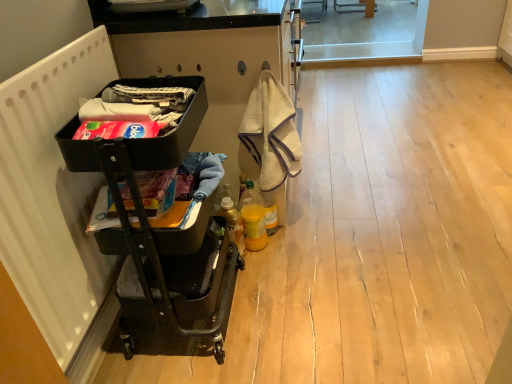
What do you see at coordinates (133, 112) in the screenshot? The image size is (512, 384). I see `matte black laundry basket at left, which appears as the 1th laundry when viewed from the top` at bounding box center [133, 112].

Locate an element on the screen. The width and height of the screenshot is (512, 384). beige towel at center is located at coordinates [271, 132].

You are a GUI agent. You are given a task and a screenshot of the screen. Output one action in this format:
    pyautogui.click(x=<x>, y=<y>)
    Task: Click on the black metal cart at left
    This screenshot has height=384, width=512.
    Given the screenshot: What is the action you would take?
    pyautogui.click(x=162, y=228)

Image resolution: width=512 pixels, height=384 pixels. What do you see at coordinates (233, 223) in the screenshot?
I see `translucent plastic bottle at lower center, which is the 1th bottle from left to right` at bounding box center [233, 223].

Describe the element at coordinates (187, 191) in the screenshot. Image resolution: width=512 pixels, height=384 pixels. I see `matte black laundry basket at left, which is the second laundry in top-to-bottom order` at that location.

Locate an element on the screen. translucent plastic bottle at center, the 2th bottle viewed from the left is located at coordinates 270,212.

I want to click on matte black laundry basket at left, which appears as the 1th laundry when viewed from the top, so click(x=133, y=112).

Is translucent plastic bottle at lower center, which is the 1th bottle from left to right, with beige towel at center?

translucent plastic bottle at lower center, which is the 1th bottle from left to right, and beige towel at center are clearly separated.

In terms of width, does translucent plastic bottle at lower center, which is the 1th bottle from left to right, look wider or thinner when compared to beige towel at center?

Considering their sizes, translucent plastic bottle at lower center, which is the 1th bottle from left to right, looks slimmer than beige towel at center.

Is translucent plastic bottle at lower center, placed as the second bottle when sorted from right to left, oriented towards beige towel at center?

No, translucent plastic bottle at lower center, placed as the second bottle when sorted from right to left, is not turned towards beige towel at center.

In the image, is matte black laundry basket at left, placed as the 1th laundry when sorted from bottom to top, positioned in front of or behind translucent plastic bottle at lower center, placed as the second bottle when sorted from right to left?

matte black laundry basket at left, placed as the 1th laundry when sorted from bottom to top, is in front of translucent plastic bottle at lower center, placed as the second bottle when sorted from right to left.

How different are the orientations of matte black laundry basket at left, which is the second laundry in top-to-bottom order, and translucent plastic bottle at lower center, which is the 1th bottle from left to right, in degrees?

The angle between the facing direction of matte black laundry basket at left, which is the second laundry in top-to-bottom order, and the facing direction of translucent plastic bottle at lower center, which is the 1th bottle from left to right, is 4.31 degrees.

From a real-world perspective, is matte black laundry basket at left, placed as the 1th laundry when sorted from bottom to top, on translucent plastic bottle at lower center, which is the 1th bottle from left to right?

Indeed, from a real-world perspective, matte black laundry basket at left, placed as the 1th laundry when sorted from bottom to top, stands above translucent plastic bottle at lower center, which is the 1th bottle from left to right.

Is matte black laundry basket at left, placed as the 1th laundry when sorted from bottom to top, wider than translucent plastic bottle at lower center, placed as the second bottle when sorted from right to left?

Yes.

From a real-world perspective, is translucent plastic bottle at lower center, which is the 1th bottle from left to right, physically located above or below black metal cart at left?

Clearly, from a real-world perspective, translucent plastic bottle at lower center, which is the 1th bottle from left to right, is below black metal cart at left.

Is point (229, 201) in front of point (198, 103)?

No, it is not.

Would you say black metal cart at left is part of translucent plastic bottle at lower center, placed as the second bottle when sorted from right to left,'s contents?

No.

Based on the photo, is translucent plastic bottle at lower center, placed as the second bottle when sorted from right to left, aimed at black metal cart at left?

No, translucent plastic bottle at lower center, placed as the second bottle when sorted from right to left, is not oriented towards black metal cart at left.

Identify the location of the 1st laundry positioned above the black metal cart at left (from a real-world perspective). The image size is (512, 384). (187, 191).

Is point (157, 81) farther from camera compared to point (216, 159)?

No.

Does black metal cart at left have a greater height compared to matte black laundry basket at left, which is the second laundry in top-to-bottom order?

Indeed, black metal cart at left has a greater height compared to matte black laundry basket at left, which is the second laundry in top-to-bottom order.

Which of these two, black metal cart at left or matte black laundry basket at left, which is the second laundry in top-to-bottom order, is bigger?

With larger size is black metal cart at left.

Measure the distance from translucent plastic bottle at center, the 1th bottle from the right, to white matte radiator at left.

translucent plastic bottle at center, the 1th bottle from the right, and white matte radiator at left are 33.37 inches apart from each other.

Are translucent plastic bottle at center, the 1th bottle from the right, and white matte radiator at left located far from each other?

translucent plastic bottle at center, the 1th bottle from the right, is actually quite close to white matte radiator at left.

Considering the sizes of translucent plastic bottle at center, the 2th bottle viewed from the left, and white matte radiator at left in the image, is translucent plastic bottle at center, the 2th bottle viewed from the left, bigger or smaller than white matte radiator at left?

Clearly, translucent plastic bottle at center, the 2th bottle viewed from the left, is smaller in size than white matte radiator at left.

Which is more to the left, translucent plastic bottle at center, the 2th bottle viewed from the left, or white matte radiator at left?

Positioned to the left is white matte radiator at left.

You are a GUI agent. You are given a task and a screenshot of the screen. Output one action in this format:
    pyautogui.click(x=<x>, y=<y>)
    Task: Click on the material that is on the right side of white matte radiator at left
    The height and width of the screenshot is (384, 512).
    Given the screenshot: What is the action you would take?
    pyautogui.click(x=271, y=132)

In terms of width, does white matte radiator at left look wider or thinner when compared to beige towel at center?

Clearly, white matte radiator at left has less width compared to beige towel at center.

Does point (78, 345) appear closer or farther from the camera than point (262, 175)?

Point (78, 345) appears to be closer to the viewer than point (262, 175).

Is white matte radiator at left outside of beige towel at center?

Yes, white matte radiator at left is located beyond the bounds of beige towel at center.

Who is taller, matte black laundry basket at left, placed as the 1th laundry when sorted from bottom to top, or matte black laundry basket at left, marked as the 2th laundry in a bottom-to-top arrangement?

Standing taller between the two is matte black laundry basket at left, marked as the 2th laundry in a bottom-to-top arrangement.

Is matte black laundry basket at left, which is the second laundry in top-to-bottom order, at the left side of matte black laundry basket at left, marked as the 2th laundry in a bottom-to-top arrangement?

No.

Consider the image. Is matte black laundry basket at left, which is the second laundry in top-to-bottom order, completely or partially outside of matte black laundry basket at left, marked as the 2th laundry in a bottom-to-top arrangement?

Absolutely, matte black laundry basket at left, which is the second laundry in top-to-bottom order, is external to matte black laundry basket at left, marked as the 2th laundry in a bottom-to-top arrangement.

Which of these two, matte black laundry basket at left, placed as the 1th laundry when sorted from bottom to top, or matte black laundry basket at left, marked as the 2th laundry in a bottom-to-top arrangement, is bigger?

matte black laundry basket at left, placed as the 1th laundry when sorted from bottom to top.

Image resolution: width=512 pixels, height=384 pixels. I want to click on material lying above the translucent plastic bottle at lower center, placed as the second bottle when sorted from right to left (from the image's perspective), so click(x=271, y=132).

At what (x,y) coordinates should I click in order to perform the action: click on the 1st laundry to the left of the translucent plastic bottle at lower center, which is the 1th bottle from left to right, starting your count from the anchor. Please return your answer as a coordinate pair (x, y). The image size is (512, 384). Looking at the image, I should click on (187, 191).

Which object lies further to the anchor point beige towel at center, translucent plastic bottle at center, the 1th bottle from the right, or white matte radiator at left?

white matte radiator at left is further to beige towel at center.

Looking at the image, which one is located further to white matte radiator at left, translucent plastic bottle at center, the 2th bottle viewed from the left, or beige towel at center?

translucent plastic bottle at center, the 2th bottle viewed from the left.

Estimate the real-world distances between objects in this image. Which object is closer to translucent plastic bottle at lower center, placed as the second bottle when sorted from right to left, translucent plastic bottle at center, the 1th bottle from the right, or black metal cart at left?

The object closer to translucent plastic bottle at lower center, placed as the second bottle when sorted from right to left, is translucent plastic bottle at center, the 1th bottle from the right.

Estimate the real-world distances between objects in this image. Which object is further from white matte radiator at left, matte black laundry basket at left, which is the second laundry in top-to-bottom order, or translucent plastic bottle at center, the 2th bottle viewed from the left?

Based on the image, translucent plastic bottle at center, the 2th bottle viewed from the left, appears to be further to white matte radiator at left.

Which object lies nearer to the anchor point beige towel at center, matte black laundry basket at left, which appears as the 1th laundry when viewed from the top, or black metal cart at left?

black metal cart at left is closer to beige towel at center.

From the image, which object appears to be nearer to beige towel at center, translucent plastic bottle at center, the 1th bottle from the right, or black metal cart at left?

translucent plastic bottle at center, the 1th bottle from the right.

Estimate the real-world distances between objects in this image. Which object is closer to white matte radiator at left, translucent plastic bottle at center, the 2th bottle viewed from the left, or matte black laundry basket at left, placed as the 1th laundry when sorted from bottom to top?

matte black laundry basket at left, placed as the 1th laundry when sorted from bottom to top, lies closer to white matte radiator at left than the other object.

Which object lies nearer to the anchor point black metal cart at left, translucent plastic bottle at center, the 1th bottle from the right, or translucent plastic bottle at lower center, which is the 1th bottle from left to right?

translucent plastic bottle at lower center, which is the 1th bottle from left to right, lies closer to black metal cart at left than the other object.

Identify the location of baby carriage between white matte radiator at left and matte black laundry basket at left, placed as the 1th laundry when sorted from bottom to top, from front to back. Image resolution: width=512 pixels, height=384 pixels. (162, 228).

Image resolution: width=512 pixels, height=384 pixels. Find the location of `material located between matte black laundry basket at left, marked as the 2th laundry in a bottom-to-top arrangement, and translucent plastic bottle at center, the 2th bottle viewed from the left, in the depth direction`. material located between matte black laundry basket at left, marked as the 2th laundry in a bottom-to-top arrangement, and translucent plastic bottle at center, the 2th bottle viewed from the left, in the depth direction is located at coordinates (271, 132).

Identify the location of bottle between white matte radiator at left and translucent plastic bottle at center, the 1th bottle from the right, in the front-back direction. (233, 223).

This screenshot has width=512, height=384. Find the location of `bottle located between matte black laundry basket at left, marked as the 2th laundry in a bottom-to-top arrangement, and translucent plastic bottle at center, the 2th bottle viewed from the left, in the depth direction`. bottle located between matte black laundry basket at left, marked as the 2th laundry in a bottom-to-top arrangement, and translucent plastic bottle at center, the 2th bottle viewed from the left, in the depth direction is located at coordinates (233, 223).